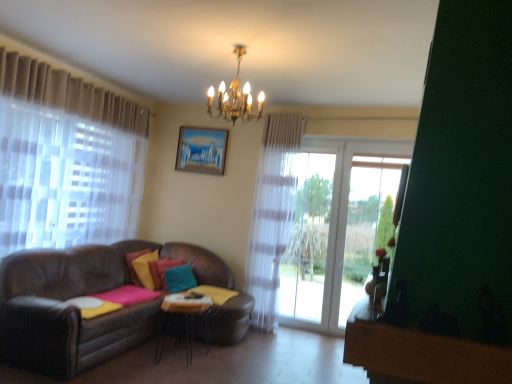
Question: Does matte wooden picture frame at upper center come in front of velvet yellow pillow at center, which is the 3th pillow in right-to-left order?

Choices:
 (A) yes
 (B) no

Answer: (B)

Question: Does matte wooden picture frame at upper center have a greater width compared to velvet yellow pillow at center, the 1th pillow positioned from the left?

Choices:
 (A) yes
 (B) no

Answer: (B)

Question: Is matte wooden picture frame at upper center further to the viewer compared to velvet yellow pillow at center, the 1th pillow positioned from the left?

Choices:
 (A) no
 (B) yes

Answer: (B)

Question: Does matte wooden picture frame at upper center have a lesser height compared to velvet yellow pillow at center, the 1th pillow positioned from the left?

Choices:
 (A) no
 (B) yes

Answer: (A)

Question: Considering the relative sizes of matte wooden picture frame at upper center and velvet yellow pillow at center, the 1th pillow positioned from the left, in the image provided, is matte wooden picture frame at upper center taller than velvet yellow pillow at center, the 1th pillow positioned from the left,?

Choices:
 (A) yes
 (B) no

Answer: (A)

Question: Considering the positions of metallic silver table at center and teal matte pillow at center, which is the 1th pillow from right to left, in the image, is metallic silver table at center taller or shorter than teal matte pillow at center, which is the 1th pillow from right to left,?

Choices:
 (A) tall
 (B) short

Answer: (A)

Question: In terms of size, does metallic silver table at center appear bigger or smaller than teal matte pillow at center, which is the 1th pillow from right to left?

Choices:
 (A) big
 (B) small

Answer: (A)

Question: Considering the positions of metallic silver table at center and teal matte pillow at center, arranged as the third pillow when viewed from the left, in the image, is metallic silver table at center wider or thinner than teal matte pillow at center, arranged as the third pillow when viewed from the left,?

Choices:
 (A) wide
 (B) thin

Answer: (A)

Question: Visually, is metallic silver table at center positioned to the left or to the right of teal matte pillow at center, arranged as the third pillow when viewed from the left?

Choices:
 (A) left
 (B) right

Answer: (B)

Question: Considering the positions of point (133, 274) and point (192, 286), is point (133, 274) closer or farther from the camera than point (192, 286)?

Choices:
 (A) closer
 (B) farther

Answer: (A)

Question: In terms of width, does velvet yellow pillow at center, the 1th pillow positioned from the left, look wider or thinner when compared to teal matte pillow at center, arranged as the third pillow when viewed from the left?

Choices:
 (A) wide
 (B) thin

Answer: (B)

Question: From the image's perspective, is velvet yellow pillow at center, the 1th pillow positioned from the left, above or below teal matte pillow at center, which is the 1th pillow from right to left?

Choices:
 (A) above
 (B) below

Answer: (A)

Question: In the image, is velvet yellow pillow at center, which is the 3th pillow in right-to-left order, positioned in front of or behind teal matte pillow at center, arranged as the third pillow when viewed from the left?

Choices:
 (A) behind
 (B) front

Answer: (A)

Question: Considering the positions of metallic silver table at center and teal matte pillow at center, the second pillow positioned from the right, in the image, is metallic silver table at center wider or thinner than teal matte pillow at center, the second pillow positioned from the right,?

Choices:
 (A) thin
 (B) wide

Answer: (B)

Question: Visually, is metallic silver table at center positioned to the left or to the right of teal matte pillow at center, placed as the second pillow when sorted from left to right?

Choices:
 (A) right
 (B) left

Answer: (A)